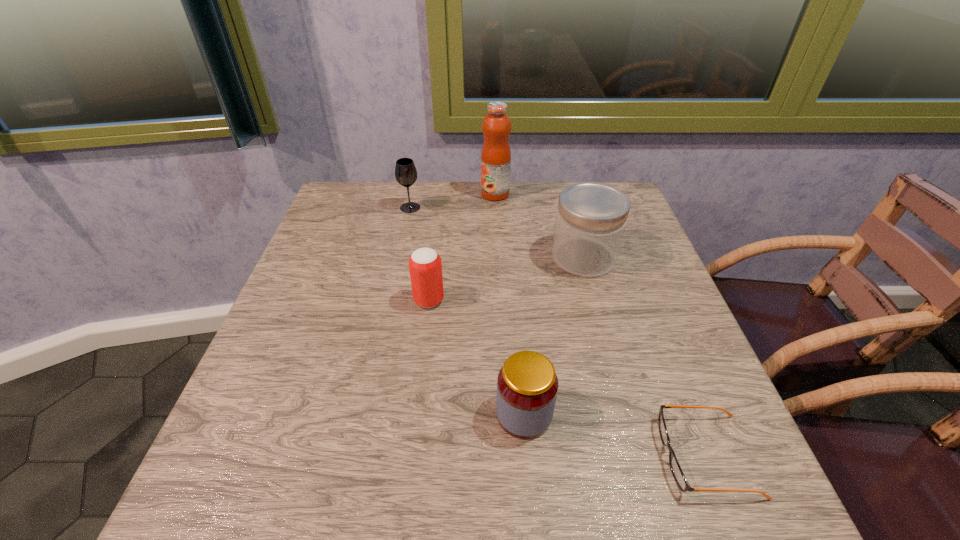
Locate an element on the screen. The width and height of the screenshot is (960, 540). fruit juice is located at coordinates (496, 155).

The height and width of the screenshot is (540, 960). Identify the location of the tallest object. (496, 155).

Locate an element on the screen. the right jar is located at coordinates (591, 217).

Locate an element on the screen. This screenshot has height=540, width=960. the farther jar is located at coordinates (591, 217).

The width and height of the screenshot is (960, 540). I want to click on the fifth nearest object, so click(x=405, y=171).

Identify the location of wineglass. The width and height of the screenshot is (960, 540). (405, 171).

Where is `the third nearest object`? Image resolution: width=960 pixels, height=540 pixels. the third nearest object is located at coordinates 425,267.

The image size is (960, 540). Find the location of `beer can`. beer can is located at coordinates (425, 267).

You are a GUI agent. You are given a task and a screenshot of the screen. Output one action in this format:
    pyautogui.click(x=<x>, y=<y>)
    Task: Click on the shorter jar
    The image size is (960, 540).
    Given the screenshot: What is the action you would take?
    pyautogui.click(x=527, y=385)

What are the coordinates of `the nearer jar` in the screenshot? It's located at (527, 385).